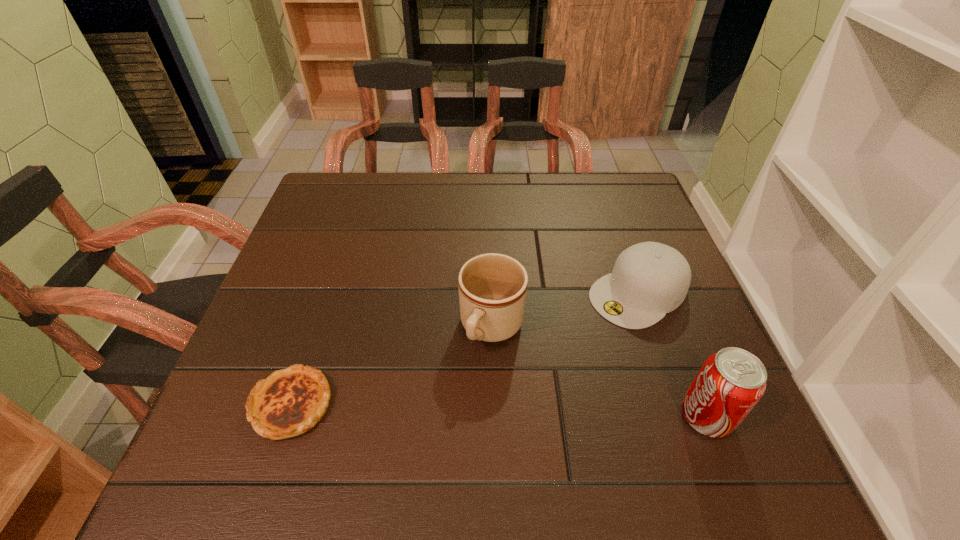
Where is `vacant space that is in between the quiche and the third tallest object`? This screenshot has height=540, width=960. vacant space that is in between the quiche and the third tallest object is located at coordinates (465, 349).

Where is `free spot between the cap and the leftmost object`? free spot between the cap and the leftmost object is located at coordinates (465, 349).

You are a GUI agent. You are given a task and a screenshot of the screen. Output one action in this format:
    pyautogui.click(x=<x>, y=<y>)
    Task: Click on the blank region between the third object from right to left and the third tallest object
    Image resolution: width=960 pixels, height=540 pixels.
    Given the screenshot: What is the action you would take?
    pyautogui.click(x=565, y=310)

Locate an element on the screen. The height and width of the screenshot is (540, 960). empty space that is in between the cap and the shortest object is located at coordinates (465, 349).

Where is `vacant point located between the quiche and the mug`? vacant point located between the quiche and the mug is located at coordinates (392, 366).

This screenshot has height=540, width=960. I want to click on free space between the soda and the mug, so point(599,372).

Locate an element on the screen. The width and height of the screenshot is (960, 540). object that stands as the third closest to the third shortest object is located at coordinates (730, 383).

At what (x,y) coordinates should I click in order to perform the action: click on object that is the second closest to the third tallest object. Please return your answer as a coordinate pair (x, y). The width and height of the screenshot is (960, 540). Looking at the image, I should click on (492, 287).

Where is `vacant space that satisfies the following two spatial constraints: 1. on the front side of the soda; 2. on the left side of the leftmost object`? The width and height of the screenshot is (960, 540). vacant space that satisfies the following two spatial constraints: 1. on the front side of the soda; 2. on the left side of the leftmost object is located at coordinates (287, 416).

The width and height of the screenshot is (960, 540). Find the location of `free region that satisfies the following two spatial constraints: 1. on the back side of the second shortest object; 2. on the right side of the third object from right to left`. free region that satisfies the following two spatial constraints: 1. on the back side of the second shortest object; 2. on the right side of the third object from right to left is located at coordinates (492, 293).